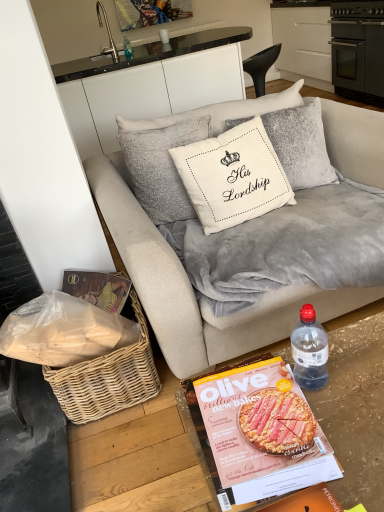
Describe the element at coordinates (127, 48) in the screenshot. I see `clear plastic bottle at upper center, positioned as the 2th bottle in right-to-left order` at that location.

What do you see at coordinates (309, 350) in the screenshot?
I see `transparent plastic bottle at lower right, which is counted as the 1th bottle, starting from the bottom` at bounding box center [309, 350].

The image size is (384, 512). What do you see at coordinates (108, 378) in the screenshot?
I see `woven wood picnic basket at lower left` at bounding box center [108, 378].

The width and height of the screenshot is (384, 512). What are the coordinates of `clear plastic bottle at upper center, the 2th bottle positioned from the bottom` in the screenshot? It's located at (127, 48).

Is white glossy cup at upper center touching matte paper magazine at lower center?

white glossy cup at upper center and matte paper magazine at lower center are not in contact.

Between white glossy cup at upper center and matte paper magazine at lower center, which one has smaller size?

Smaller between the two is white glossy cup at upper center.

Does point (164, 37) appear closer or farther from the camera than point (290, 459)?

Point (164, 37).

This screenshot has height=512, width=384. What are the coordinates of `appliance behind the velvet beige couch at center` in the screenshot? It's located at (358, 49).

From the image's perspective, is velvet beige couch at center on black matte oven at upper right?

No, from the image's perspective, velvet beige couch at center is not on top of black matte oven at upper right.

Which is correct: velvet beige couch at center is inside black matte oven at upper right, or outside of it?

velvet beige couch at center is located beyond the bounds of black matte oven at upper right.

Is point (323, 309) less distant than point (376, 29)?

Yes, it is.

Between white glossy cup at upper center and woven wicker basket at lower left, which one is positioned in front?

Positioned in front is woven wicker basket at lower left.

From the image's perspective, which is below, white glossy cup at upper center or woven wicker basket at lower left?

woven wicker basket at lower left, from the image's perspective.

Based on the photo, how many degrees apart are the facing directions of white glossy cup at upper center and woven wicker basket at lower left?

The angular difference between white glossy cup at upper center and woven wicker basket at lower left is 173 degrees.

Is white glossy cup at upper center placed right next to woven wicker basket at lower left?

white glossy cup at upper center is not next to woven wicker basket at lower left, and they're not touching.

Considering the positions of objects silver metallic faucet at upper left and velvet gray blanket at center in the image provided, who is behind, silver metallic faucet at upper left or velvet gray blanket at center?

silver metallic faucet at upper left is further from the camera.

Is silver metallic faucet at upper left turned away from velvet gray blanket at center?

Yes, silver metallic faucet at upper left is positioned with its back facing velvet gray blanket at center.

Looking at this image, measure the distance from silver metallic faucet at upper left to velvet gray blanket at center.

silver metallic faucet at upper left and velvet gray blanket at center are 2.93 meters apart.

Is silver metallic faucet at upper left completely or partially outside of velvet gray blanket at center?

Absolutely, silver metallic faucet at upper left is external to velvet gray blanket at center.

Measure the distance from clear plastic bottle at upper center, placed as the 1th bottle when sorted from left to right, to velvet beige couch at center.

clear plastic bottle at upper center, placed as the 1th bottle when sorted from left to right, is 7.55 feet from velvet beige couch at center.

From a real-world perspective, is clear plastic bottle at upper center, positioned as the 2th bottle in right-to-left order, physically located above or below velvet beige couch at center?

clear plastic bottle at upper center, positioned as the 2th bottle in right-to-left order, is above velvet beige couch at center.

Is clear plastic bottle at upper center, the 2th bottle viewed from the front, far away from velvet beige couch at center?

Absolutely, clear plastic bottle at upper center, the 2th bottle viewed from the front, is distant from velvet beige couch at center.

Is clear plastic bottle at upper center, positioned as the 1th bottle in back-to-front order, turned away from velvet beige couch at center?

Yes, clear plastic bottle at upper center, positioned as the 1th bottle in back-to-front order, is facing away from velvet beige couch at center.

Considering the sizes of velvet gray blanket at center and transparent plastic bottle at lower right, which is the first bottle in front-to-back order, in the image, is velvet gray blanket at center bigger or smaller than transparent plastic bottle at lower right, which is the first bottle in front-to-back order,?

velvet gray blanket at center is bigger than transparent plastic bottle at lower right, which is the first bottle in front-to-back order.

Which is more to the right, velvet gray blanket at center or transparent plastic bottle at lower right, arranged as the first bottle when viewed from the right?

velvet gray blanket at center is more to the right.

Considering the sizes of velvet gray blanket at center and transparent plastic bottle at lower right, which is the 2th bottle from left to right, in the image, is velvet gray blanket at center taller or shorter than transparent plastic bottle at lower right, which is the 2th bottle from left to right,?

Clearly, velvet gray blanket at center is taller compared to transparent plastic bottle at lower right, which is the 2th bottle from left to right.

From a real-world perspective, is velvet gray blanket at center on transparent plastic bottle at lower right, which is counted as the 1th bottle, starting from the bottom?

Actually, velvet gray blanket at center is physically below transparent plastic bottle at lower right, which is counted as the 1th bottle, starting from the bottom, in the real world.

From the image's perspective, which one is positioned lower, transparent plastic bottle at lower right, which is counted as the 1th bottle, starting from the bottom, or velvet gray blanket at center?

transparent plastic bottle at lower right, which is counted as the 1th bottle, starting from the bottom, from the image's perspective.

Is transparent plastic bottle at lower right, which is the 2th bottle from left to right, oriented towards velvet gray blanket at center?

No, transparent plastic bottle at lower right, which is the 2th bottle from left to right, does not turn towards velvet gray blanket at center.

Which is less distant, (301, 371) or (350, 266)?

Point (301, 371) appears to be closer to the viewer than point (350, 266).

Considering their positions, is transparent plastic bottle at lower right, which is the 2th bottle from back to front, located in front of or behind velvet gray blanket at center?

transparent plastic bottle at lower right, which is the 2th bottle from back to front, is in front of velvet gray blanket at center.

Locate an element on the screen. coffee cup above the matte paper magazine at lower center (from the image's perspective) is located at coordinates (164, 36).

Find the location of a particular element. appliance to the right of velvet beige couch at center is located at coordinates (358, 49).

Which object lies nearer to the anchor point velvet gray blanket at center, woven wicker basket at lower left or velvet beige couch at center?

Based on the image, velvet beige couch at center appears to be nearer to velvet gray blanket at center.

Looking at the image, which one is located further to velvet beige couch at center, silver metallic faucet at upper left or clear plastic bottle at upper center, positioned as the first bottle in top-to-bottom order?

silver metallic faucet at upper left is further to velvet beige couch at center.

Based on their spatial positions, is white glossy cup at upper center or silver metallic faucet at upper left closer to matte paper magazine at lower center?

Among the two, silver metallic faucet at upper left is located nearer to matte paper magazine at lower center.

Looking at the image, which one is located further to woven wood picnic basket at lower left, clear plastic bottle at upper center, positioned as the first bottle in top-to-bottom order, or woven wicker basket at lower left?

clear plastic bottle at upper center, positioned as the first bottle in top-to-bottom order.

Looking at the image, which one is located further to matte paper magazine at lower center, white glossy cup at upper center or white cotton cushion at center?

Among the two, white glossy cup at upper center is located further to matte paper magazine at lower center.

From the image, which object appears to be farther from velvet gray blanket at center, matte paper magazine at lower center or transparent plastic bottle at lower right, arranged as the first bottle when viewed from the right?

matte paper magazine at lower center is further to velvet gray blanket at center.

Based on their spatial positions, is woven wicker basket at lower left or white glossy cup at upper center further from matte paper magazine at lower center?

Among the two, white glossy cup at upper center is located further to matte paper magazine at lower center.

Based on the photo, considering their positions, is white glossy cup at upper center positioned further to woven wicker basket at lower left than white cotton cushion at center?

white glossy cup at upper center is positioned further to the anchor woven wicker basket at lower left.

Find the location of `bottle between white cotton cushion at center and woven wood picnic basket at lower left in the up-down direction`. bottle between white cotton cushion at center and woven wood picnic basket at lower left in the up-down direction is located at coordinates (309, 350).

Identify the location of material between clear plastic bottle at upper center, the 2th bottle positioned from the bottom, and woven wood picnic basket at lower left in the up-down direction. (63, 331).

Find the location of a particular element. The image size is (384, 512). material between matte paper magazine at lower center and clear plastic bottle at upper center, the 2th bottle viewed from the front, along the z-axis is located at coordinates (63, 331).

Where is `pillow located between transparent plastic bottle at lower right, the 2th bottle when ordered from top to bottom, and clear plastic bottle at upper center, placed as the 1th bottle when sorted from left to right, in the depth direction`? The image size is (384, 512). pillow located between transparent plastic bottle at lower right, the 2th bottle when ordered from top to bottom, and clear plastic bottle at upper center, placed as the 1th bottle when sorted from left to right, in the depth direction is located at coordinates (233, 176).